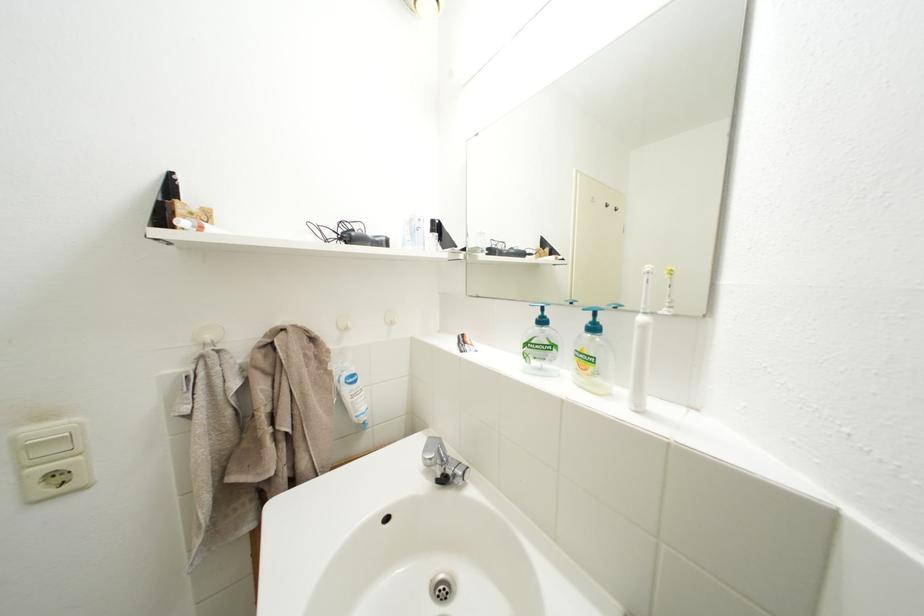
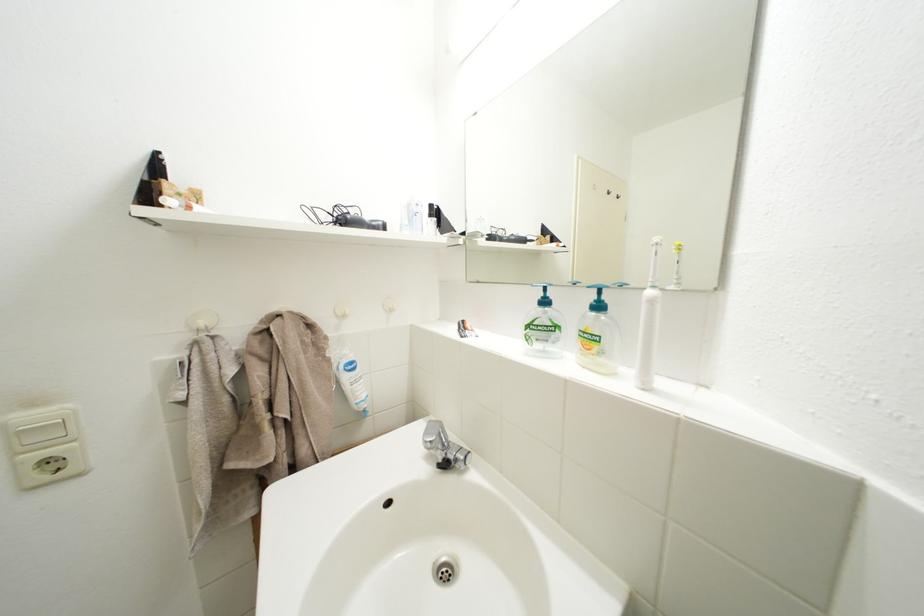
Question: How did the camera likely rotate?

Choices:
 (A) Left
 (B) Right
 (C) Up
 (D) Down

Answer: (D)